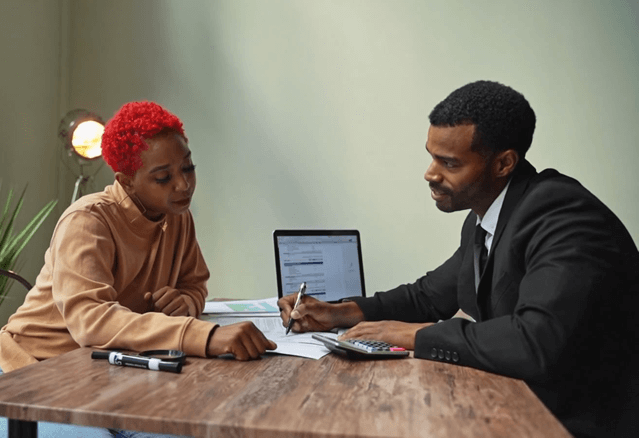
The width and height of the screenshot is (639, 438). What are the coordinates of `laptop` in the screenshot? It's located at (324, 259).